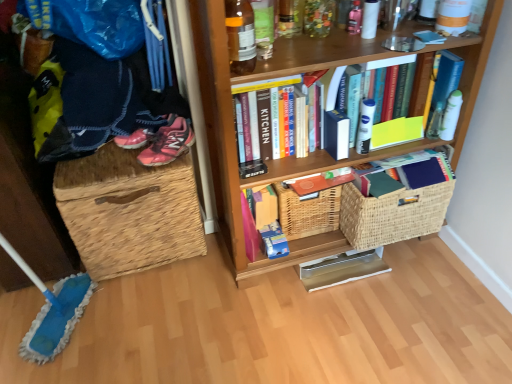
Question: Is pink mesh sneakers at left aimed at woven wicker basket at right, marked as the second basket in a left-to-right arrangement?

Choices:
 (A) no
 (B) yes

Answer: (A)

Question: Is pink mesh sneakers at left smaller than woven wicker basket at right, positioned as the 1th basket in right-to-left order?

Choices:
 (A) no
 (B) yes

Answer: (B)

Question: Can you confirm if pink mesh sneakers at left is positioned to the left of woven wicker basket at right, positioned as the 1th basket in right-to-left order?

Choices:
 (A) yes
 (B) no

Answer: (A)

Question: Can you confirm if pink mesh sneakers at left is wider than woven wicker basket at right, marked as the second basket in a left-to-right arrangement?

Choices:
 (A) no
 (B) yes

Answer: (B)

Question: Does pink mesh sneakers at left lie in front of woven wicker basket at right, marked as the second basket in a left-to-right arrangement?

Choices:
 (A) yes
 (B) no

Answer: (A)

Question: Does pink mesh sneakers at left contain woven wicker basket at right, positioned as the 1th basket in right-to-left order?

Choices:
 (A) yes
 (B) no

Answer: (B)

Question: Is translucent glass bottle at upper center completely or partially inside pink matte book at center, the second book positioned from the bottom?

Choices:
 (A) yes
 (B) no

Answer: (B)

Question: Considering the relative sizes of pink matte book at center, the 2th book when ordered from top to bottom, and translucent glass bottle at upper center in the image provided, is pink matte book at center, the 2th book when ordered from top to bottom, smaller than translucent glass bottle at upper center?

Choices:
 (A) yes
 (B) no

Answer: (B)

Question: Can you confirm if pink matte book at center, the second book positioned from the bottom, is positioned to the right of translucent glass bottle at upper center?

Choices:
 (A) yes
 (B) no

Answer: (A)

Question: Does pink matte book at center, the 2th book when ordered from top to bottom, have a larger size compared to translucent glass bottle at upper center?

Choices:
 (A) no
 (B) yes

Answer: (B)

Question: From a real-world perspective, is pink matte book at center, the 2th book when ordered from top to bottom, positioned over translucent glass bottle at upper center based on gravity?

Choices:
 (A) yes
 (B) no

Answer: (B)

Question: From the image's perspective, is pink matte book at center, the 2th book when ordered from top to bottom, located above translucent glass bottle at upper center?

Choices:
 (A) no
 (B) yes

Answer: (A)

Question: Does woven straw laundry basket at left contain pink matte book at center, the second book positioned from the bottom?

Choices:
 (A) yes
 (B) no

Answer: (B)